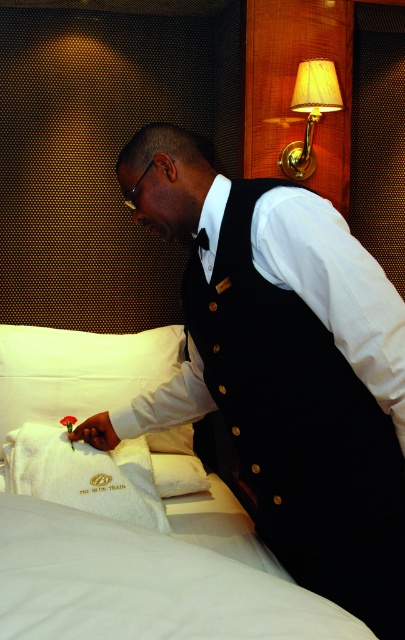
Question: Which point is closer to the camera?

Choices:
 (A) black satin vest at center
 (B) white soft pillow at center
 (C) white embroidered towel at lower left

Answer: (A)

Question: Can you confirm if black satin vest at center is wider than white soft pillow at center?

Choices:
 (A) no
 (B) yes

Answer: (B)

Question: Does white soft pillow at center lie behind beige fabric lamp at upper right?

Choices:
 (A) yes
 (B) no

Answer: (B)

Question: Which point is farther to the camera?

Choices:
 (A) white soft pillow at center
 (B) black satin vest at center

Answer: (A)

Question: Does black satin vest at center have a greater width compared to white soft pillow at center?

Choices:
 (A) yes
 (B) no

Answer: (A)

Question: Which point is farther to the camera?

Choices:
 (A) black satin vest at center
 (B) beige fabric lamp at upper right
 (C) white embroidered towel at lower left
 (D) white soft pillow at center

Answer: (B)